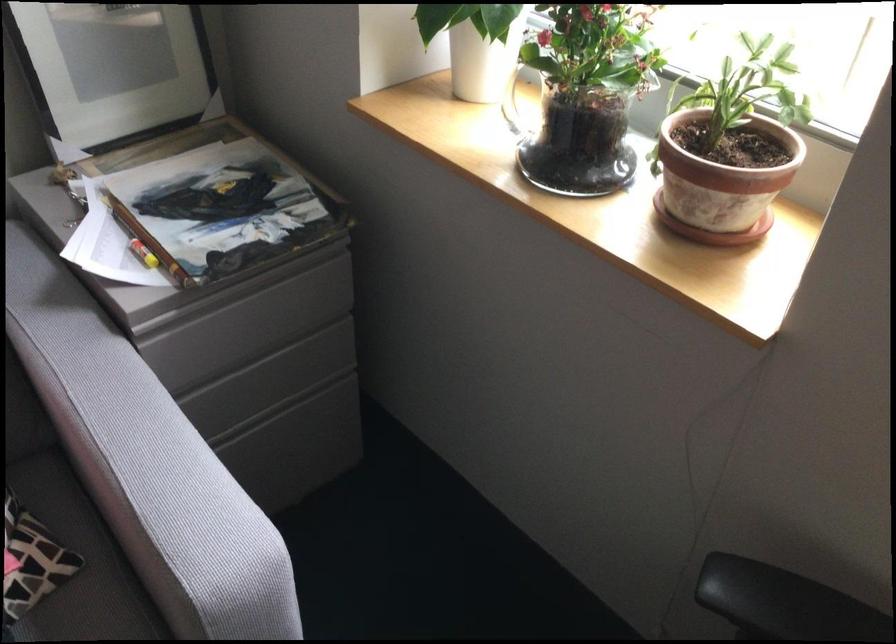
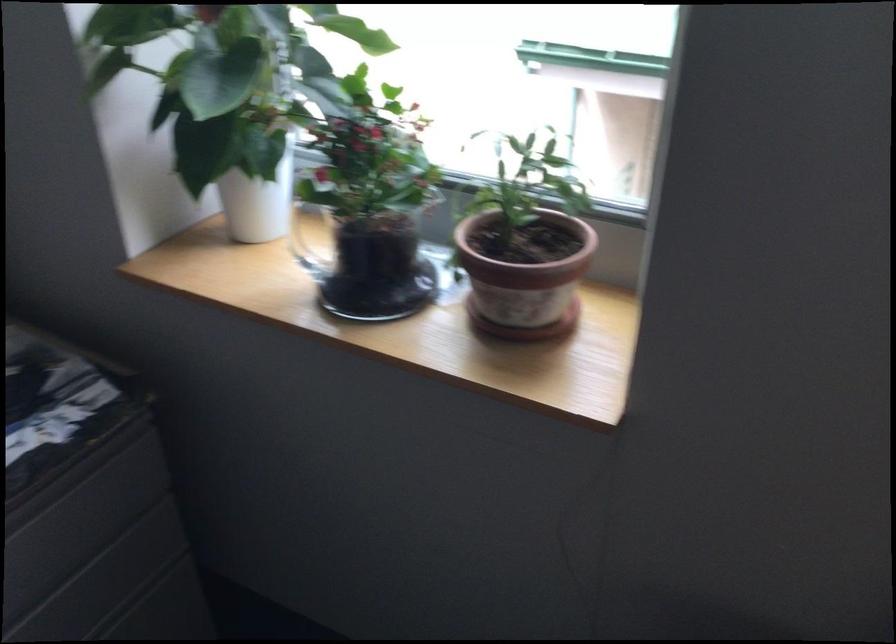
Question: The images are taken continuously from a first-person perspective. In which direction are you moving?

Choices:
 (A) Left
 (B) Right
 (C) Forward
 (D) Backward

Answer: (C)